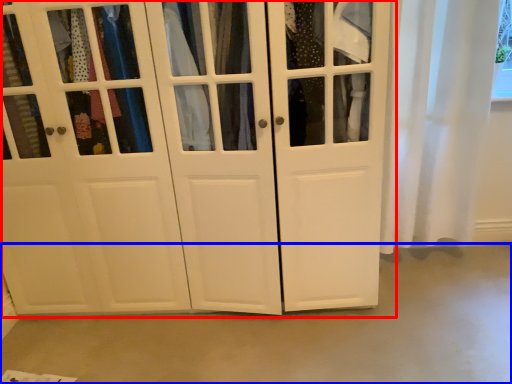
Question: Which object appears closest to the camera in this image, cupboard (highlighted by a red box) or concrete (highlighted by a blue box)?

Choices:
 (A) cupboard
 (B) concrete

Answer: (A)